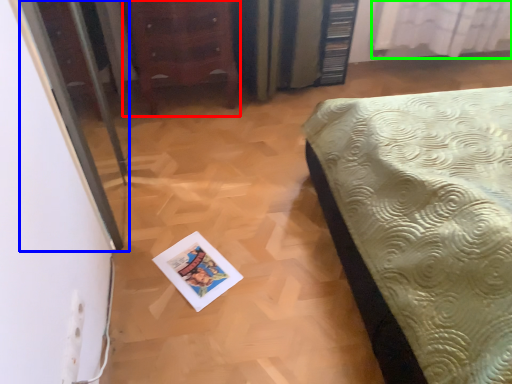
Question: Which object is positioned farthest from furniture (highlighted by a red box)? Select from screen door (highlighted by a blue box) and curtain (highlighted by a green box).

Choices:
 (A) screen door
 (B) curtain

Answer: (B)